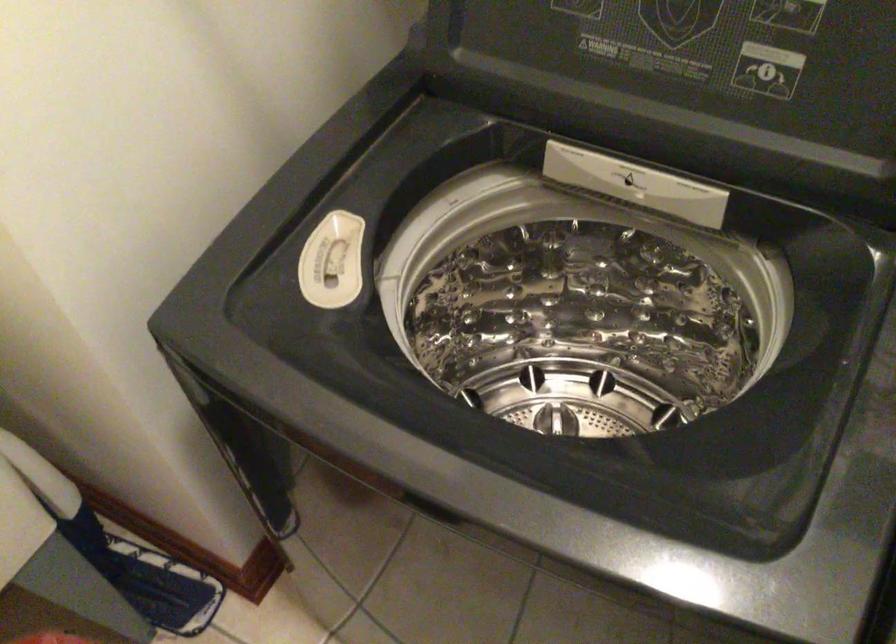
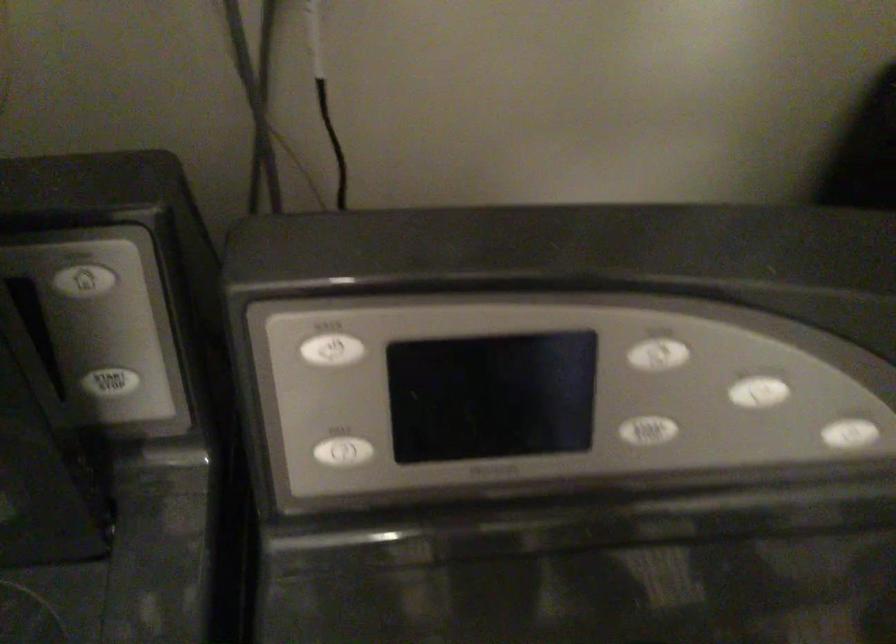
Question: Based on the continuous images, in which direction is the camera rotating? Reply with the corresponding letter.

Choices:
 (A) Left
 (B) Right
 (C) Up
 (D) Down

Answer: (B)